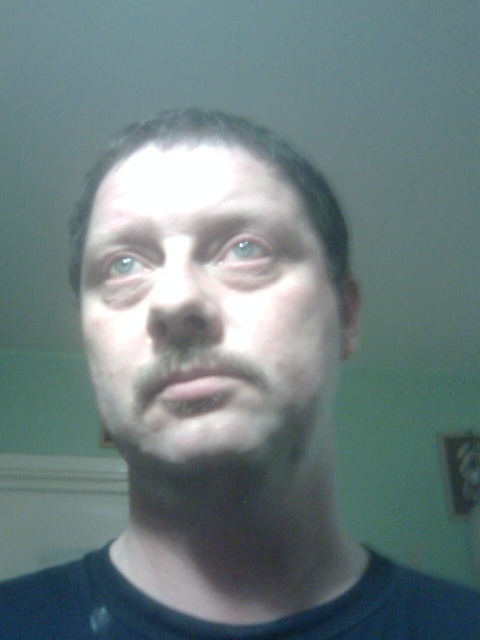
Question: Does blue matte eye at center appear on the left side of blue matte eye at upper left?

Choices:
 (A) no
 (B) yes

Answer: (A)

Question: Among these points, which one is nearest to the camera?

Choices:
 (A) (264, 244)
 (B) (116, 256)
 (C) (136, 260)
 (D) (204, 182)

Answer: (A)

Question: From the image, what is the correct spatial relationship of blue matte eye at center in relation to blue matte eye at upper left?

Choices:
 (A) left
 (B) right

Answer: (B)

Question: Which point is closer to the camera?

Choices:
 (A) (251, 257)
 (B) (133, 426)
 (C) (146, 269)
 (D) (135, 236)

Answer: (B)

Question: Which point is farther to the camera?

Choices:
 (A) (145, 384)
 (B) (252, 253)
 (C) (132, 253)

Answer: (C)

Question: Is gray matte eyebrow at upper left thinner than blue matte eye at upper left?

Choices:
 (A) yes
 (B) no

Answer: (B)